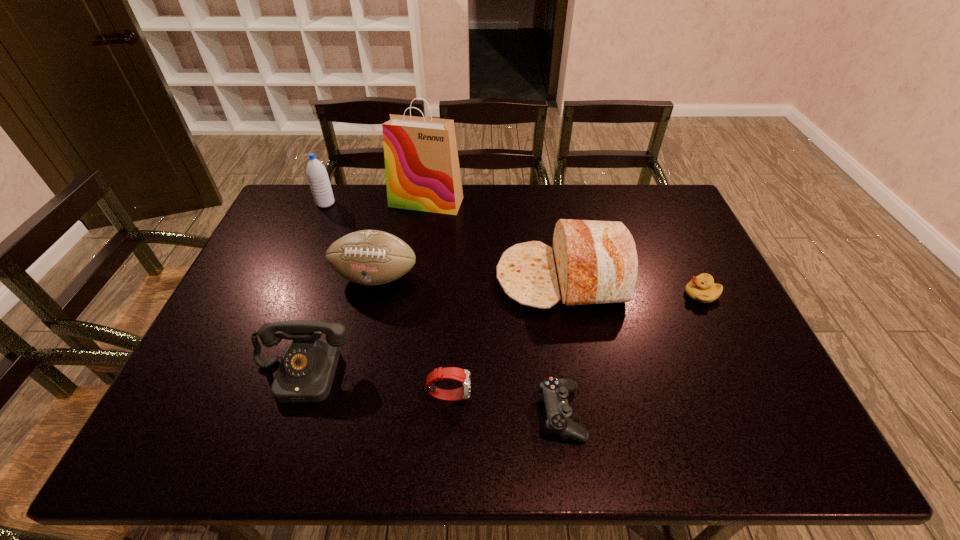
What are the coordinates of `vacant space at the left edge of the desktop` in the screenshot? It's located at coord(242,281).

Where is `vacant space at the right edge of the desktop`? The image size is (960, 540). vacant space at the right edge of the desktop is located at coordinates (729, 315).

Locate an element on the screen. Image resolution: width=960 pixels, height=540 pixels. free space at the near left corner of the desktop is located at coordinates (188, 438).

The width and height of the screenshot is (960, 540). In the image, there is a desktop. Find the location of `vacant space at the far right corner`. vacant space at the far right corner is located at coordinates (683, 224).

What are the coordinates of `vacant area that lies between the bread and the water bottle` in the screenshot? It's located at (444, 241).

The height and width of the screenshot is (540, 960). Identify the location of unoccupied position between the water bottle and the tallest object. 376,202.

The image size is (960, 540). Identify the location of free space between the second shortest object and the shortest object. (631, 354).

The image size is (960, 540). What are the coordinates of `vacant region between the football (American) and the third shortest object` in the screenshot? It's located at (412, 336).

The height and width of the screenshot is (540, 960). Identify the location of vacant area that lies between the football (American) and the sixth tallest object. (412, 336).

The height and width of the screenshot is (540, 960). I want to click on free space between the tallest object and the water bottle, so click(376, 202).